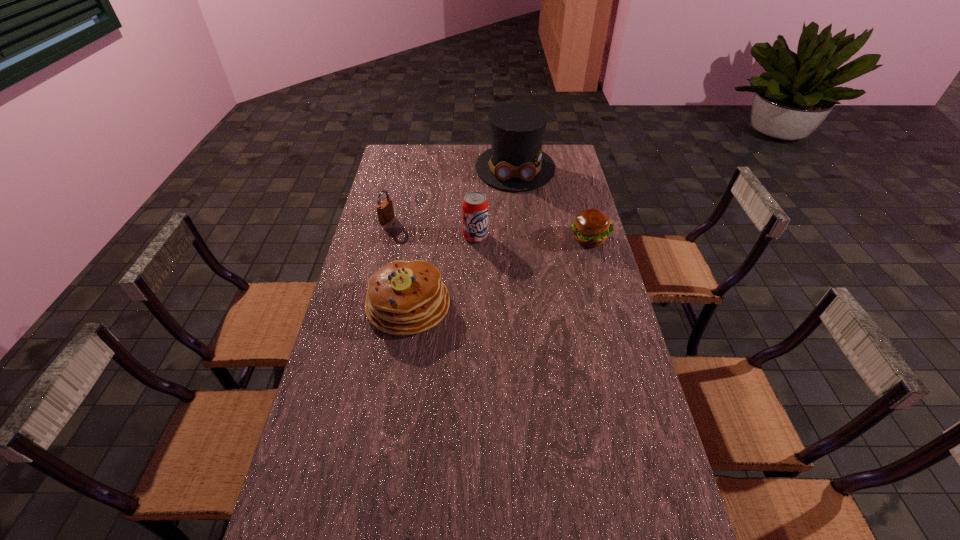
This screenshot has height=540, width=960. I want to click on vacant space located 0.330m with goggles on the front of the tallest object, so click(518, 243).

In order to click on vacant space located 0.280m on the surface of the second tallest object in this screenshot , I will do `click(515, 293)`.

Where is `vacant space situated on the surface of the second tallest object`? This screenshot has width=960, height=540. vacant space situated on the surface of the second tallest object is located at coordinates (523, 305).

I want to click on blank area located on the surface of the second tallest object, so click(488, 253).

At what (x,y) coordinates should I click in order to perform the action: click on vacant space situated on the front-facing side of the fourth nearest object. Please return your answer as a coordinate pair (x, y). The image size is (960, 540). Looking at the image, I should click on (479, 252).

You are a GUI agent. You are given a task and a screenshot of the screen. Output one action in this format:
    pyautogui.click(x=<x>, y=<y>)
    Task: Click on the blank space located on the front-facing side of the fourth nearest object
    The image size is (960, 540).
    Given the screenshot: What is the action you would take?
    pyautogui.click(x=449, y=242)

Where is `free location located 0.150m on the front-facing side of the fourth nearest object`? This screenshot has width=960, height=540. free location located 0.150m on the front-facing side of the fourth nearest object is located at coordinates (424, 233).

Identify the location of object situated at the far edge. (516, 162).

This screenshot has height=540, width=960. I want to click on pancake located at the left edge, so click(403, 298).

Image resolution: width=960 pixels, height=540 pixels. In order to click on padlock that is at the left edge in this screenshot , I will do `click(385, 211)`.